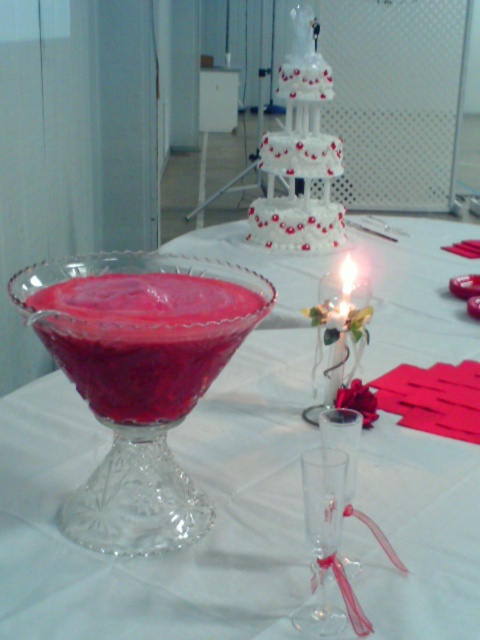
Question: Can you confirm if transparent crystal martini glass at center is positioned above matte white candle at center?

Choices:
 (A) yes
 (B) no

Answer: (B)

Question: Estimate the real-world distances between objects in this image. Which object is closer to the transparent crystal martini glass at center?

Choices:
 (A) clear glass wine glass at center
 (B) matte glass bowl at center
 (C) transparent glass punch bowl at center
 (D) matte white candle at center

Answer: (B)

Question: Does matte glass bowl at center appear over clear glass wine glass at center?

Choices:
 (A) yes
 (B) no

Answer: (A)

Question: Can you confirm if transparent glass punch bowl at center is positioned below transparent glass at center?

Choices:
 (A) no
 (B) yes

Answer: (A)

Question: Considering the real-world distances, which object is closest to the transparent crystal martini glass at center?

Choices:
 (A) clear glass wine glass at center
 (B) transparent glass at center

Answer: (B)

Question: Which object is closer to the camera taking this photo?

Choices:
 (A) matte glass bowl at center
 (B) clear glass wine glass at center
 (C) matte white candle at center
 (D) transparent glass punch bowl at center

Answer: (B)